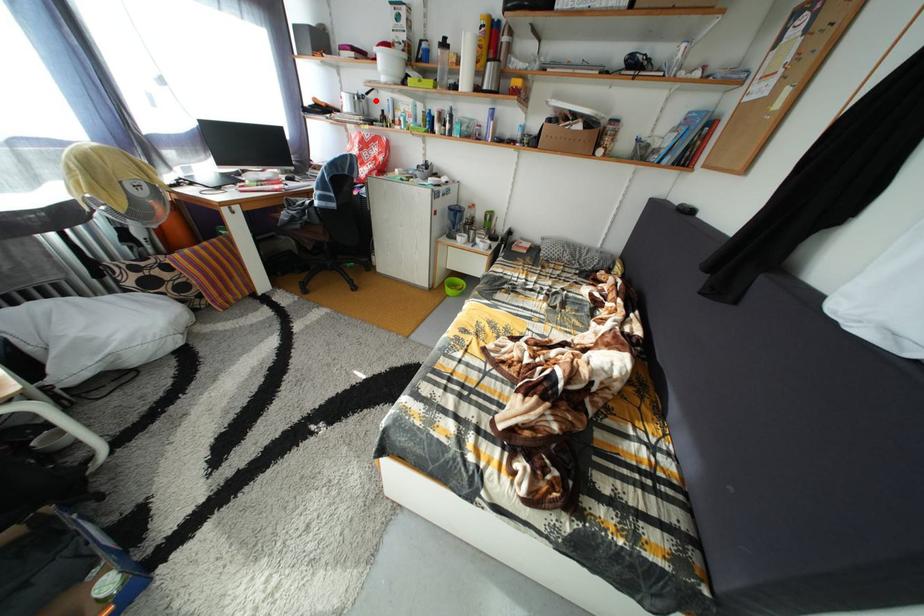
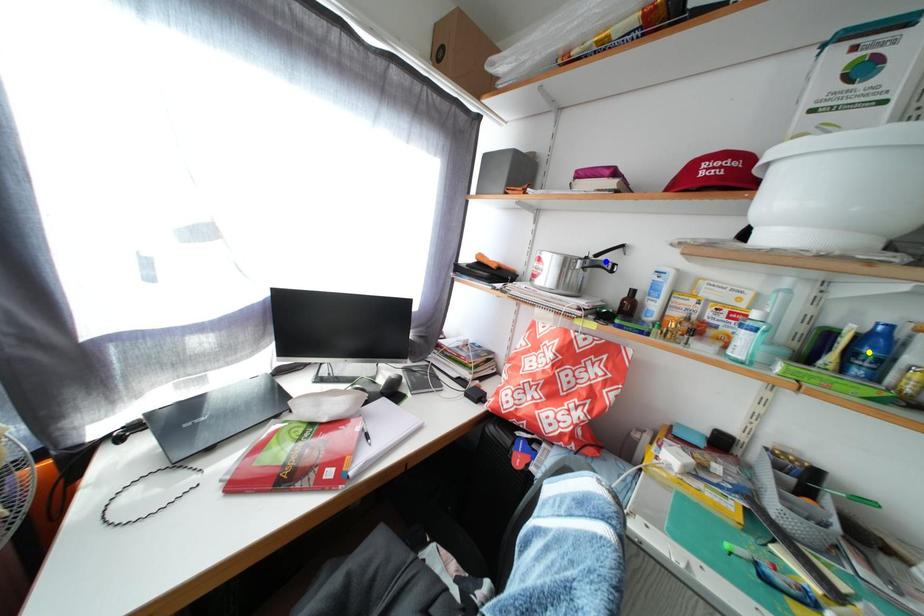
Question: I am providing you with two images of the same scene from different viewpoints. A red point is marked on the first image. You are given multiple points on the second image. Which spot in image 2 lines up with the point in image 1?

Choices:
 (A) green point
 (B) blue point
 (C) yellow point

Answer: (B)